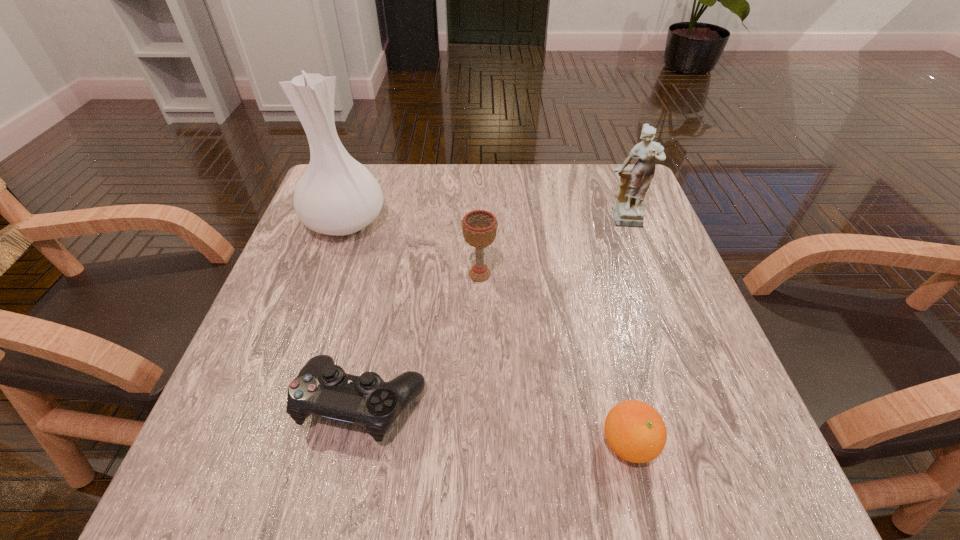
Image resolution: width=960 pixels, height=540 pixels. Find the location of `vacant space located 0.210m on the right of the control`. vacant space located 0.210m on the right of the control is located at coordinates (556, 403).

Image resolution: width=960 pixels, height=540 pixels. Find the location of `vacant region located 0.300m on the left of the fourth object from left to right`. vacant region located 0.300m on the left of the fourth object from left to right is located at coordinates (399, 444).

Where is `vase present at the far edge`? Image resolution: width=960 pixels, height=540 pixels. vase present at the far edge is located at coordinates (337, 195).

The width and height of the screenshot is (960, 540). I want to click on figurine located at the far edge, so click(x=628, y=211).

Identify the location of control that is at the near edge. This screenshot has width=960, height=540. (321, 388).

The height and width of the screenshot is (540, 960). I want to click on orange that is at the near edge, so click(x=635, y=431).

I want to click on vase that is at the left edge, so click(x=337, y=195).

Find the location of a particular element. This screenshot has width=960, height=540. control positioned at the left edge is located at coordinates (321, 388).

Where is `figurine present at the right edge`? This screenshot has width=960, height=540. figurine present at the right edge is located at coordinates (628, 211).

Locate an element on the screen. orange at the right edge is located at coordinates (635, 431).